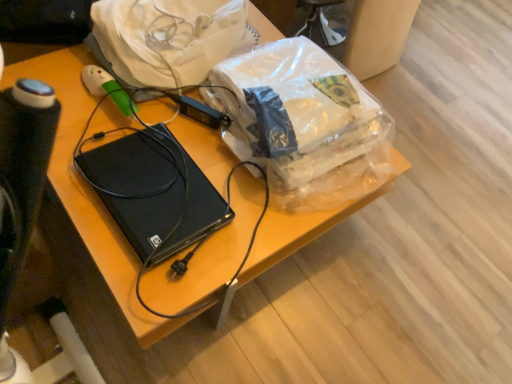
The width and height of the screenshot is (512, 384). Find the location of `black plastic computer at center`. black plastic computer at center is located at coordinates (139, 185).

Find the location of a particular element. black plastic computer at center is located at coordinates (139, 185).

How many degrees apart are the facing directions of white plastic bag at upper center and translucent plastic bag at center?

The angle between the facing direction of white plastic bag at upper center and the facing direction of translucent plastic bag at center is 2.79 degrees.

Is white plastic bag at upper center bigger than translucent plastic bag at center?

Yes.

Is point (202, 17) closer or farther from the camera than point (328, 137)?

Point (202, 17) is farther from the camera than point (328, 137).

From the picture: Is white plastic bag at upper center not within translucent plastic bag at center?

Absolutely, white plastic bag at upper center is external to translucent plastic bag at center.

Is black plastic computer at center taller or shorter than translucent plastic bag at center?

Considering their sizes, black plastic computer at center has less height than translucent plastic bag at center.

Can you tell me how much black plastic computer at center and translucent plastic bag at center differ in facing direction?

The angular difference between black plastic computer at center and translucent plastic bag at center is 92.3 degrees.

Which point is more distant from viewer, (215, 220) or (306, 160)?

The point (306, 160) is more distant.

Relative to translucent plastic bag at center, is black plastic computer at center in front or behind?

In the image, black plastic computer at center appears in front of translucent plastic bag at center.

From the picture: Is translucent plastic bag at center completely or partially outside of white plastic bag at upper center?

translucent plastic bag at center is positioned outside white plastic bag at upper center.

Looking at this image, considering the sizes of translucent plastic bag at center and white plastic bag at upper center in the image, is translucent plastic bag at center wider or thinner than white plastic bag at upper center?

Considering their sizes, translucent plastic bag at center looks broader than white plastic bag at upper center.

Is translucent plastic bag at center to the right of white plastic bag at upper center from the viewer's perspective?

Yes, translucent plastic bag at center is to the right of white plastic bag at upper center.

From a real-world perspective, which object rests below the other?

In real-world perspective, black plastic computer at center is lower.

In the scene shown: Is the depth of black plastic computer at center greater than that of white plastic bag at upper center?

No, the depth of black plastic computer at center is less than that of white plastic bag at upper center.

Considering the sizes of objects black plastic computer at center and white plastic bag at upper center in the image provided, who is thinner, black plastic computer at center or white plastic bag at upper center?

Thinner between the two is black plastic computer at center.

Is black plastic computer at center turned away from white plastic bag at upper center?

black plastic computer at center does not have its back to white plastic bag at upper center.

This screenshot has height=384, width=512. I want to click on material that is on the right side of black plastic computer at center, so click(x=166, y=38).

Is white plastic bag at upper center oriented away from black plastic computer at center?

No.

From the image's perspective, which one is positioned higher, white plastic bag at upper center or black plastic computer at center?

white plastic bag at upper center, from the image's perspective.

From a real-world perspective, is translucent plastic bag at center positioned above or below black plastic computer at center?

translucent plastic bag at center is above black plastic computer at center.

Is translucent plastic bag at center positioned behind black plastic computer at center?

Yes, it is behind black plastic computer at center.

At what (x,y) coordinates should I click in order to perform the action: click on plastic bag behind the black plastic computer at center. Please return your answer as a coordinate pair (x, y). This screenshot has width=512, height=384. Looking at the image, I should click on (304, 123).

Does translucent plastic bag at center have a lesser width compared to black plastic computer at center?

Incorrect, the width of translucent plastic bag at center is not less than that of black plastic computer at center.

Where is `material on the left of translucent plastic bag at center`? This screenshot has width=512, height=384. material on the left of translucent plastic bag at center is located at coordinates (166, 38).

Find the location of a particular element. The image size is (512, 384). plastic bag lying on the right of black plastic computer at center is located at coordinates (304, 123).

From the image, which object appears to be farther from translucent plastic bag at center, black plastic computer at center or white plastic bag at upper center?

black plastic computer at center is positioned further to the anchor translucent plastic bag at center.

Considering their positions, is black plastic computer at center positioned further to white plastic bag at upper center than translucent plastic bag at center?

black plastic computer at center lies further to white plastic bag at upper center than the other object.

When comparing their distances from black plastic computer at center, does white plastic bag at upper center or translucent plastic bag at center seem further?

white plastic bag at upper center.

When comparing their distances from translucent plastic bag at center, does white plastic bag at upper center or black plastic computer at center seem closer?

white plastic bag at upper center.

Considering their positions, is translucent plastic bag at center positioned closer to black plastic computer at center than white plastic bag at upper center?

Based on the image, translucent plastic bag at center appears to be nearer to black plastic computer at center.

Which object lies further to the anchor point white plastic bag at upper center, translucent plastic bag at center or black plastic computer at center?

black plastic computer at center lies further to white plastic bag at upper center than the other object.

I want to click on plastic bag between white plastic bag at upper center and black plastic computer at center vertically, so click(x=304, y=123).